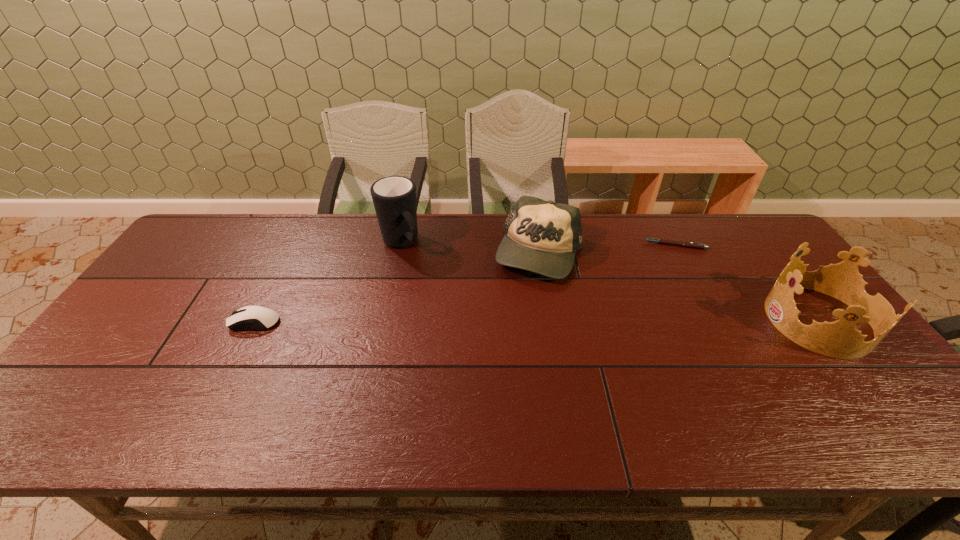
Find the location of `free space that satisfies the following two spatial constraints: 1. on the front side of the tiara; 2. on the front-facing side of the baseball cap`. free space that satisfies the following two spatial constraints: 1. on the front side of the tiara; 2. on the front-facing side of the baseball cap is located at coordinates (550, 320).

Locate an element on the screen. vacant space that satisfies the following two spatial constraints: 1. on the front side of the tiara; 2. on the front-facing side of the third object from right to left is located at coordinates (550, 320).

Identify the location of free space that satisfies the following two spatial constraints: 1. on the front side of the mug; 2. on the right side of the baseball cap. (399, 253).

Image resolution: width=960 pixels, height=540 pixels. What are the coordinates of `free location that satisfies the following two spatial constraints: 1. on the front side of the third shortest object; 2. on the front-facing side of the rightmost object` in the screenshot? It's located at (550, 320).

The width and height of the screenshot is (960, 540). Find the location of `free space in the image that satisfies the following two spatial constraints: 1. on the back side of the baseball cap; 2. on the left side of the second shortest object`. free space in the image that satisfies the following two spatial constraints: 1. on the back side of the baseball cap; 2. on the left side of the second shortest object is located at coordinates (290, 253).